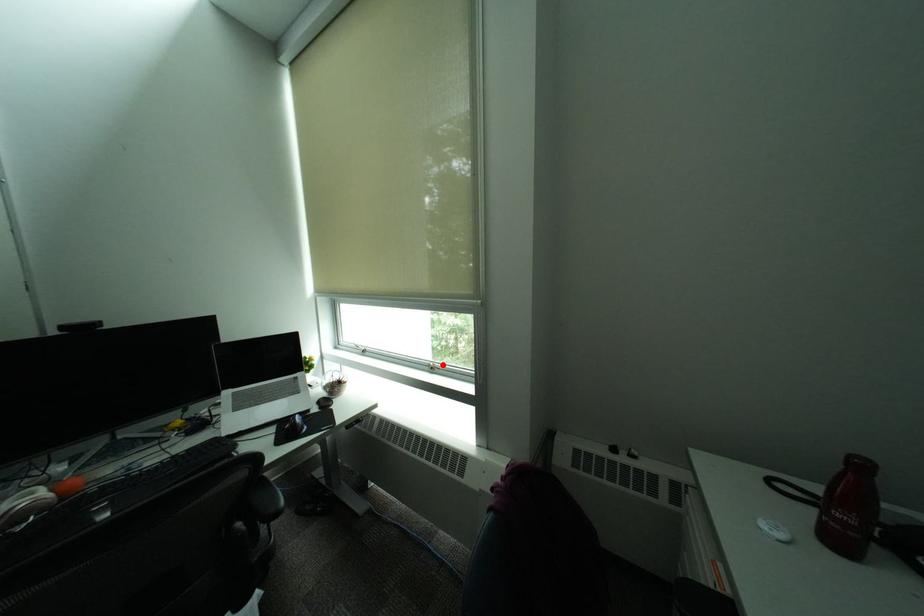
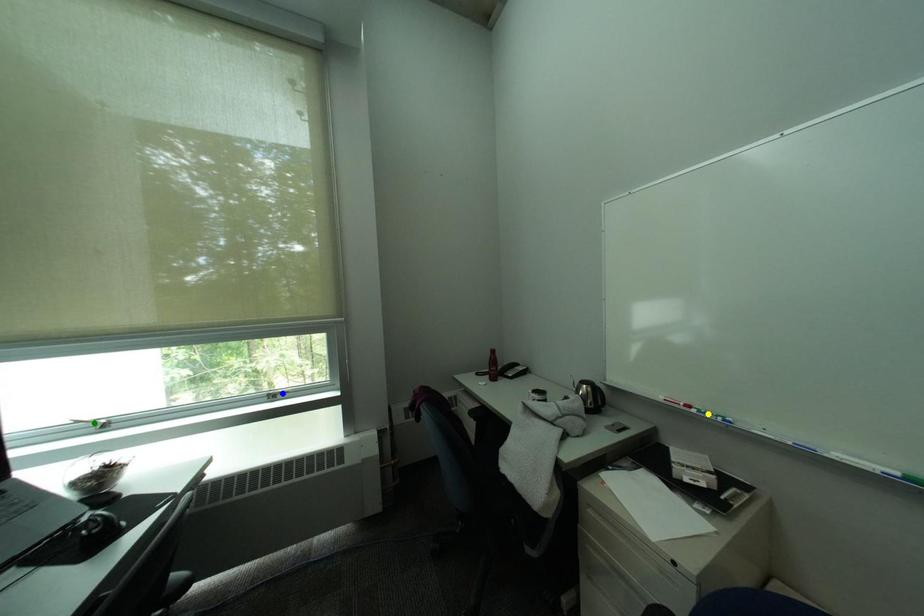
Question: I am providing you with two images of the same scene from different viewpoints. A red point is marked on the first image. You are given multiple points on the second image. Which point in image 2 represents the same 3d spot as the red point in image 1?

Choices:
 (A) green point
 (B) yellow point
 (C) blue point

Answer: (C)